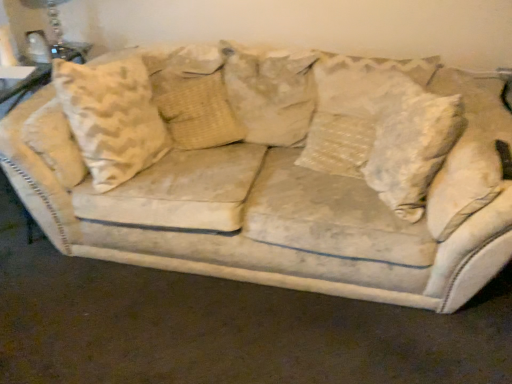
Question: From a real-world perspective, is beige textured pillow at center, which ranks as the 1th pillow in left-to-right order, located beneath clear glass table lamp at upper left?

Choices:
 (A) yes
 (B) no

Answer: (A)

Question: Does beige textured pillow at center, which ranks as the 1th pillow in left-to-right order, come in front of clear glass table lamp at upper left?

Choices:
 (A) no
 (B) yes

Answer: (B)

Question: From the image's perspective, would you say beige textured pillow at center, arranged as the 3th pillow when viewed from the right, is positioned over clear glass table lamp at upper left?

Choices:
 (A) no
 (B) yes

Answer: (A)

Question: From the image's perspective, does beige textured pillow at center, arranged as the 3th pillow when viewed from the right, appear lower than clear glass table lamp at upper left?

Choices:
 (A) yes
 (B) no

Answer: (A)

Question: Is beige textured pillow at center, which ranks as the 1th pillow in left-to-right order, bigger than clear glass table lamp at upper left?

Choices:
 (A) yes
 (B) no

Answer: (A)

Question: From the image's perspective, is beige textured pillow at center, arranged as the 3th pillow when viewed from the right, above or below beige fabric pillow at center, which is counted as the 2th pillow, starting from the left?

Choices:
 (A) below
 (B) above

Answer: (A)

Question: Is beige textured pillow at center, which ranks as the 1th pillow in left-to-right order, taller or shorter than beige fabric pillow at center, which is counted as the 2th pillow, starting from the left?

Choices:
 (A) short
 (B) tall

Answer: (A)

Question: Which is correct: beige textured pillow at center, which ranks as the 1th pillow in left-to-right order, is inside beige fabric pillow at center, arranged as the 2th pillow when viewed from the right, or outside of it?

Choices:
 (A) inside
 (B) outside

Answer: (B)

Question: Is point (153, 74) closer or farther from the camera than point (278, 89)?

Choices:
 (A) farther
 (B) closer

Answer: (A)

Question: Choose the correct answer: Is beige textured pillow at center, which ranks as the 1th pillow in left-to-right order, inside white textured pillow at center, arranged as the first pillow when viewed from the right, or outside it?

Choices:
 (A) inside
 (B) outside

Answer: (B)

Question: From the image's perspective, relative to white textured pillow at center, which is counted as the 3th pillow, starting from the left, is beige textured pillow at center, arranged as the 3th pillow when viewed from the right, above or below?

Choices:
 (A) above
 (B) below

Answer: (A)

Question: Is point (214, 114) closer or farther from the camera than point (347, 175)?

Choices:
 (A) closer
 (B) farther

Answer: (B)

Question: Is beige textured pillow at center, which ranks as the 1th pillow in left-to-right order, taller or shorter than white textured pillow at center, which is counted as the 3th pillow, starting from the left?

Choices:
 (A) tall
 (B) short

Answer: (B)

Question: Looking at their shapes, would you say clear glass table lamp at upper left is wider or thinner than beige fabric pillow at center, which is counted as the 2th pillow, starting from the left?

Choices:
 (A) thin
 (B) wide

Answer: (A)

Question: Is point (62, 41) positioned closer to the camera than point (285, 97)?

Choices:
 (A) farther
 (B) closer

Answer: (A)